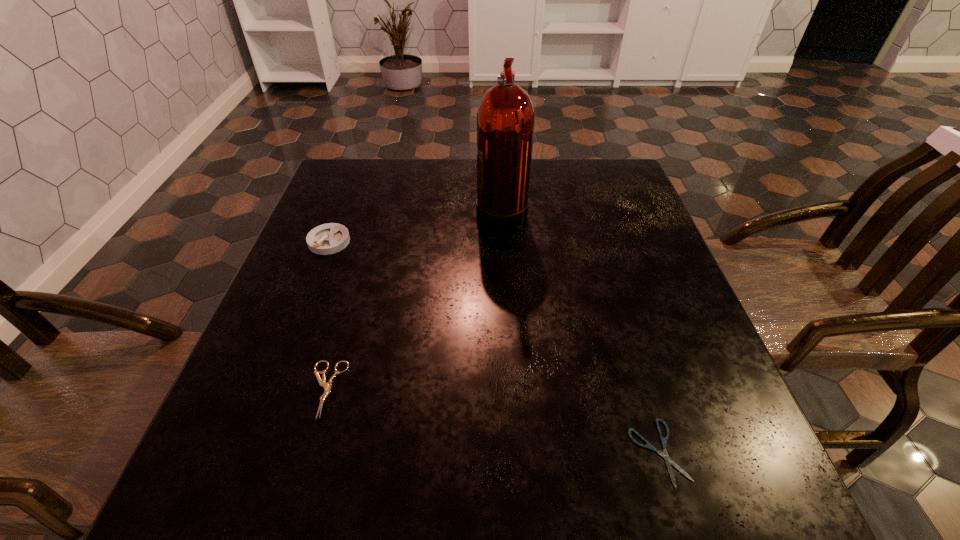
This screenshot has height=540, width=960. Identify the location of free location that satisfies the following two spatial constraints: 1. on the front-facing side of the fire extinguisher; 2. on the left side of the shortest object. (516, 452).

The width and height of the screenshot is (960, 540). I want to click on vacant space that satisfies the following two spatial constraints: 1. on the front side of the leftmost object; 2. on the right side of the rightmost object, so click(x=248, y=452).